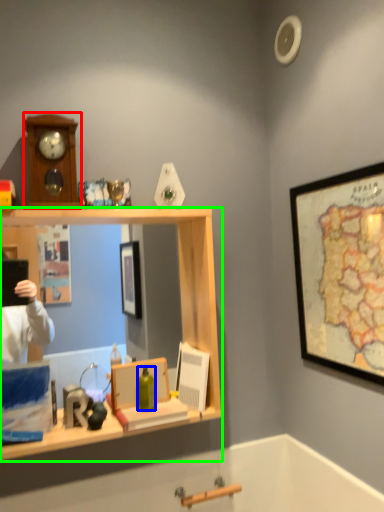
Question: Based on their relative distances, which object is farther from clock (highlighted by a red box)? Choose from bottle (highlighted by a blue box) and desk (highlighted by a green box).

Choices:
 (A) bottle
 (B) desk

Answer: (A)